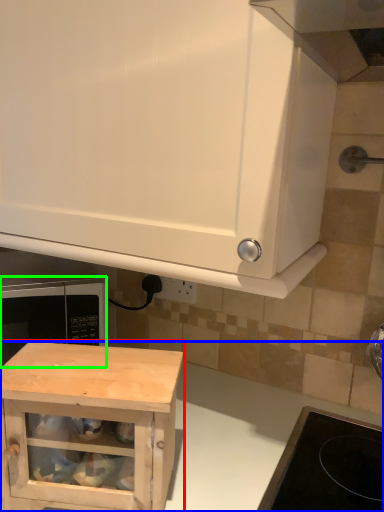
Question: Which object is the closest to the cabinetry (highlighted by a red box)? Choose among these: counter (highlighted by a blue box) or microwave oven (highlighted by a green box).

Choices:
 (A) counter
 (B) microwave oven

Answer: (A)